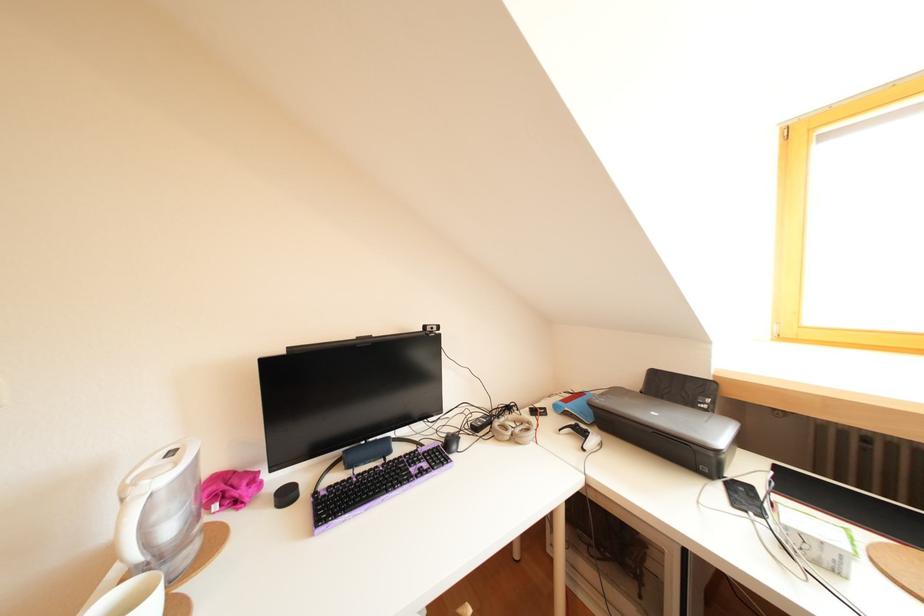
Find where to click the white computer mouse. Please return your answer as a coordinate pair (x, y).

(514, 429)